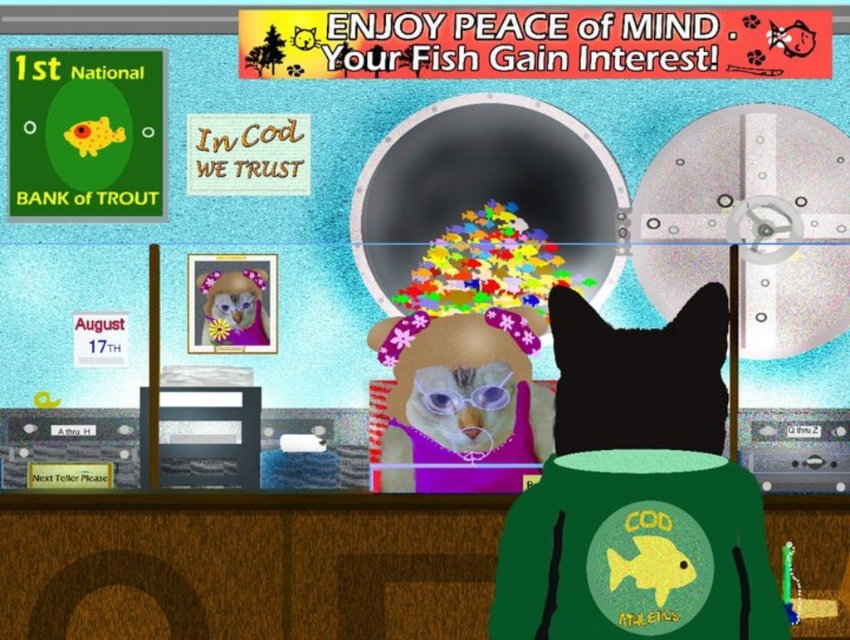
Question: Which point is closer to the camera?

Choices:
 (A) fluffy pink teddy bear at center
 (B) black fur cat at center

Answer: (B)

Question: Which of the following is the farthest from the observer?

Choices:
 (A) (213, 340)
 (B) (672, 428)

Answer: (A)

Question: Which point is farther to the camera?

Choices:
 (A) black fur cat at center
 (B) fluffy pink teddy bear at center

Answer: (B)

Question: Does black fur cat at center appear over fluffy pink teddy bear at center?

Choices:
 (A) no
 (B) yes

Answer: (A)

Question: Is black fur cat at center smaller than fluffy pink teddy bear at center?

Choices:
 (A) no
 (B) yes

Answer: (A)

Question: Does black fur cat at center appear on the right side of fluffy pink teddy bear at center?

Choices:
 (A) yes
 (B) no

Answer: (A)